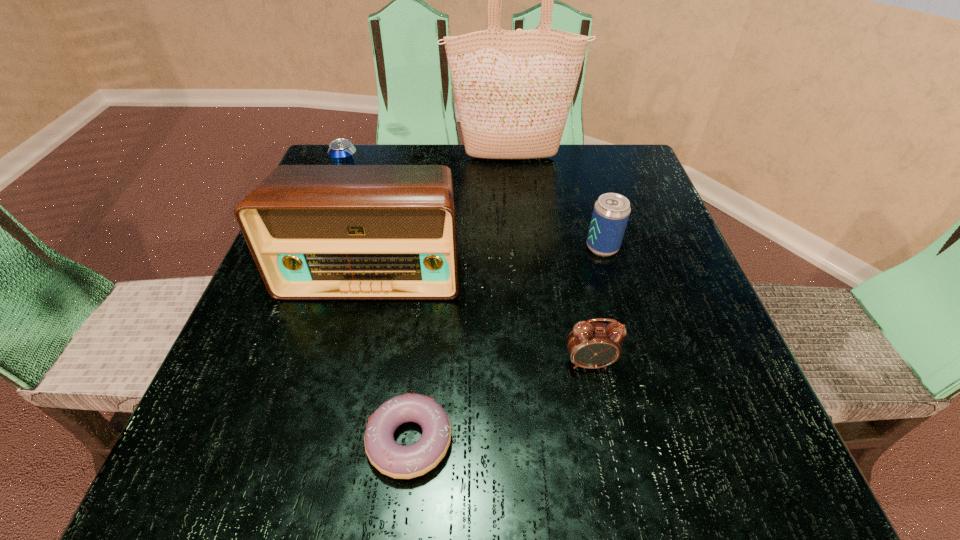
Identify the location of shopping bag. This screenshot has height=540, width=960. (513, 88).

Identify the location of the tallest object. The height and width of the screenshot is (540, 960). (513, 88).

The width and height of the screenshot is (960, 540). Find the location of `radio receiver`. radio receiver is located at coordinates (316, 232).

Locate an element on the screen. This screenshot has width=960, height=540. the left beer can is located at coordinates (341, 151).

Where is `the farther beer can`? the farther beer can is located at coordinates tap(341, 151).

At what (x,y) coordinates should I click in order to perform the action: click on the nearer beer can. Please return your answer as a coordinate pair (x, y). Looking at the image, I should click on (611, 212).

I want to click on the second nearest object, so click(x=590, y=345).

I want to click on the nearest object, so click(398, 461).

This screenshot has height=540, width=960. Find the location of `doughnut`. doughnut is located at coordinates (398, 461).

Locate an element on the screen. This screenshot has height=540, width=960. vacant position located on the left of the shopping bag is located at coordinates (387, 157).